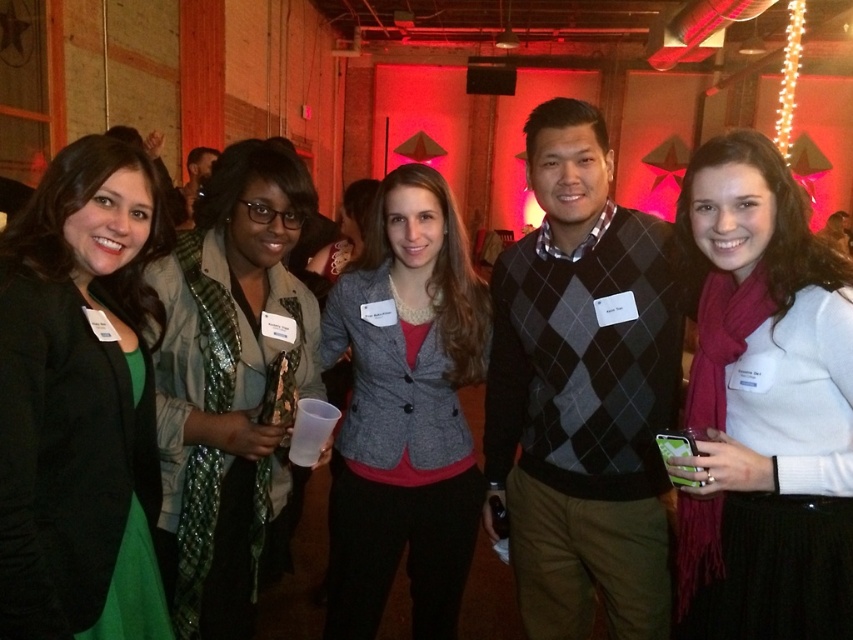
Can you confirm if green matte blazer at left is smaller than green textured scarf at left?

Yes.

You are a GUI agent. You are given a task and a screenshot of the screen. Output one action in this format:
    pyautogui.click(x=<x>, y=<y>)
    Task: Click on the green matte blazer at left
    Image resolution: width=853 pixels, height=640 pixels.
    Given the screenshot: What is the action you would take?
    pyautogui.click(x=74, y=392)

Does white sweater at center have a larger size compared to green matte blazer at left?

Correct, white sweater at center is larger in size than green matte blazer at left.

Is white sweater at center to the right of green matte blazer at left from the viewer's perspective?

Yes, white sweater at center is to the right of green matte blazer at left.

Which is in front, point (730, 252) or point (61, 296)?

Point (61, 296) is in front.

I want to click on white sweater at center, so click(764, 406).

Is white sweater at center closer to the viewer compared to green textured scarf at left?

Yes.

Who is positioned more to the right, white sweater at center or green textured scarf at left?

white sweater at center is more to the right.

Is point (721, 301) more distant than point (242, 577)?

No, it is not.

Image resolution: width=853 pixels, height=640 pixels. Find the location of `white sweater at center`. white sweater at center is located at coordinates (764, 406).